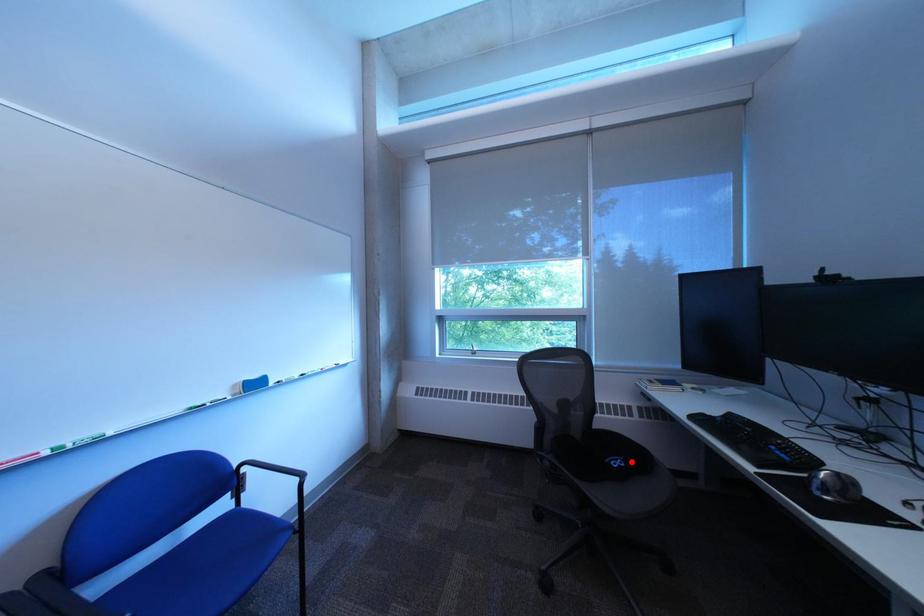
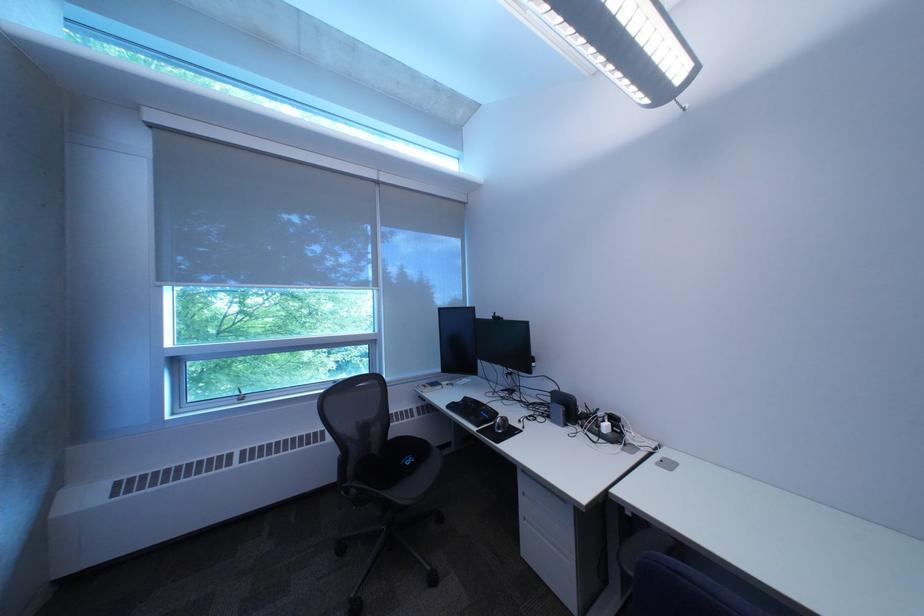
Question: I am providing you with two images of the same scene from different viewpoints. A red point is marked on the first image. Can you still see the location of the red point in image 2?

Choices:
 (A) Yes
 (B) No

Answer: (A)